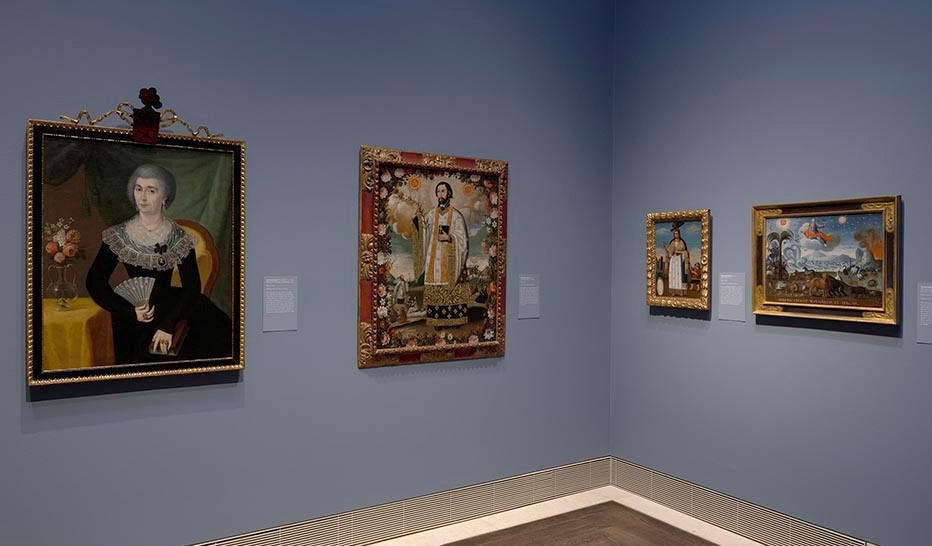
At what (x,y) coordinates should I click in order to perform the action: click on vase of flowers. Please return your answer as a coordinate pair (x, y). Looking at the image, I should click on (61, 282).